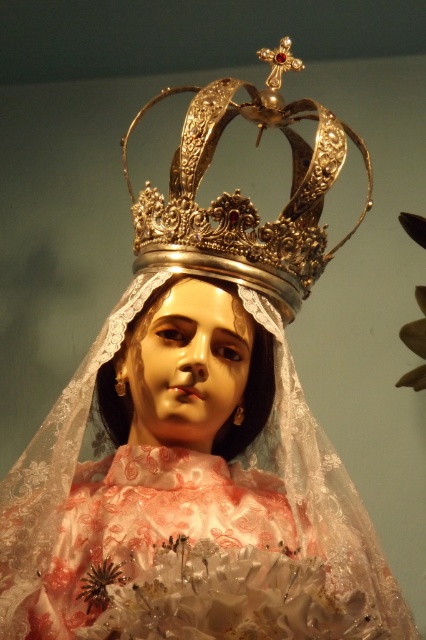
Question: Does gold metallic crown at upper center have a larger size compared to matte porcelain head at center?

Choices:
 (A) no
 (B) yes

Answer: (B)

Question: Is gold metallic crown at upper center below matte porcelain head at center?

Choices:
 (A) no
 (B) yes

Answer: (A)

Question: Is gold metallic crown at upper center above matte porcelain head at center?

Choices:
 (A) yes
 (B) no

Answer: (A)

Question: Which of the following is the closest to the observer?

Choices:
 (A) [270, 241]
 (B) [270, 340]

Answer: (A)